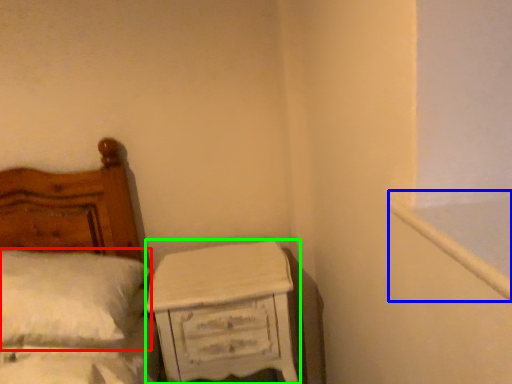
Question: Based on their relative distances, which object is farther from pillow (highlighted by a red box)? Choose from window frame (highlighted by a blue box) and nightstand (highlighted by a green box).

Choices:
 (A) window frame
 (B) nightstand

Answer: (A)